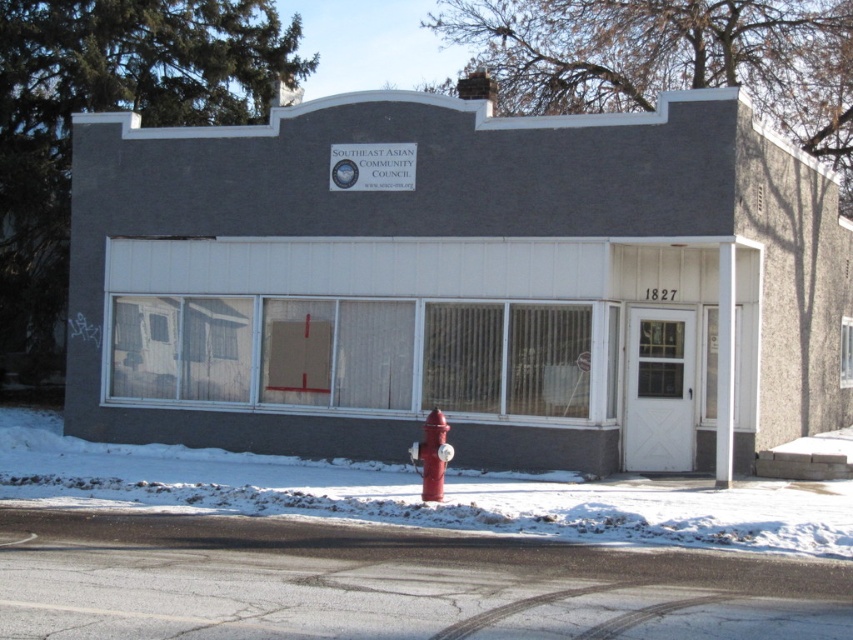
Question: Which point is closer to the camera?

Choices:
 (A) red matte fire hydrant at lower center
 (B) white powdery snow at lower center

Answer: (B)

Question: Is white powdery snow at lower center wider than red matte fire hydrant at lower center?

Choices:
 (A) yes
 (B) no

Answer: (A)

Question: Which of the following is the farthest from the observer?

Choices:
 (A) (258, 512)
 (B) (437, 477)

Answer: (B)

Question: Is white powdery snow at lower center further to the viewer compared to red matte fire hydrant at lower center?

Choices:
 (A) no
 (B) yes

Answer: (A)

Question: In this image, where is white powdery snow at lower center located relative to red matte fire hydrant at lower center?

Choices:
 (A) below
 (B) above

Answer: (A)